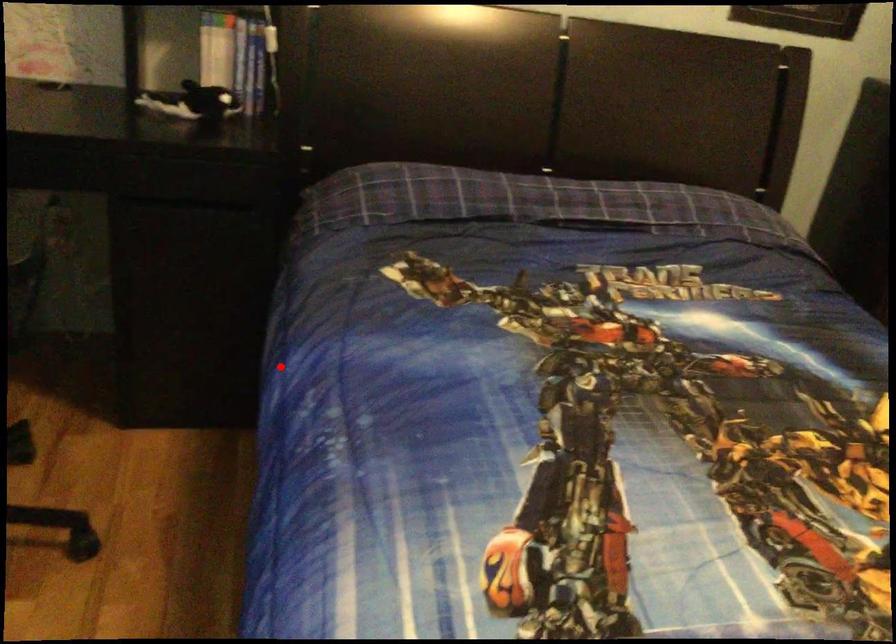
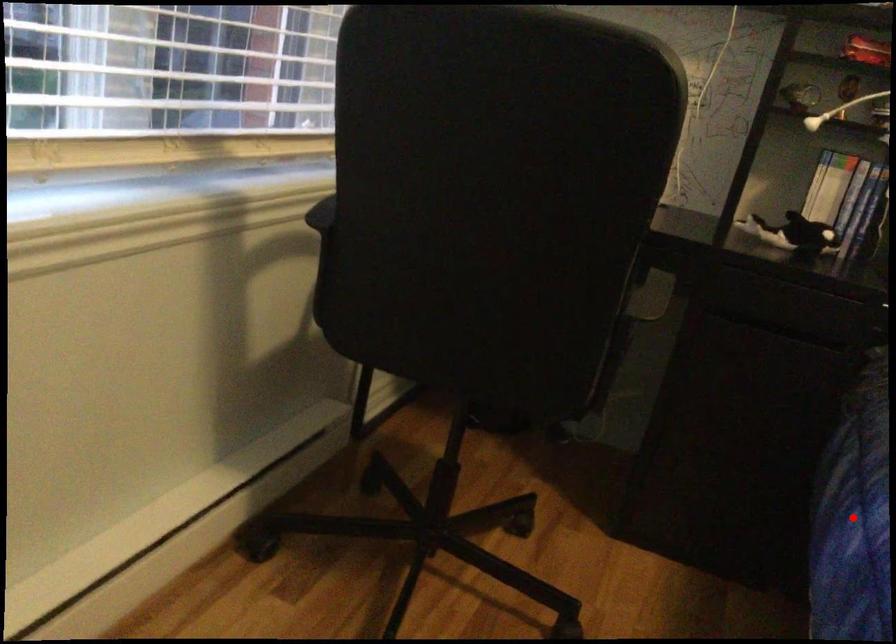
I am providing you with two images of the same scene from different viewpoints. A red point is marked on the first image and another point is marked on the second image. Do the highlighted points in image1 and image2 indicate the same real-world spot?

Yes